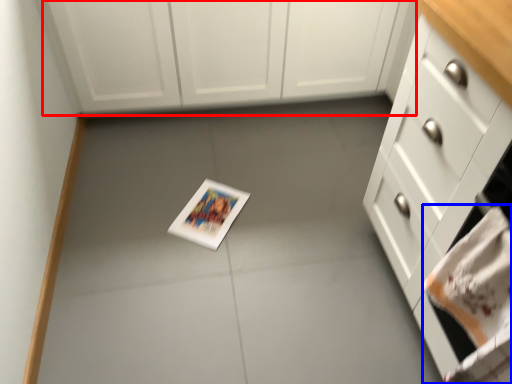
Question: Among these objects, which one is nearest to the camera, cabinetry (highlighted by a red box) or hand towel (highlighted by a blue box)?

Choices:
 (A) cabinetry
 (B) hand towel

Answer: (B)